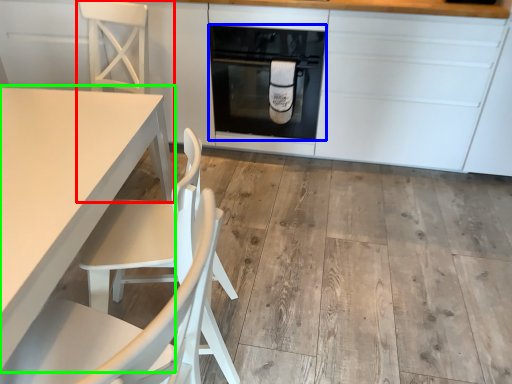
Question: Based on their relative distances, which object is farther from chair (highlighted by a red box)? Choose from home appliance (highlighted by a blue box) and table (highlighted by a green box).

Choices:
 (A) home appliance
 (B) table

Answer: (B)